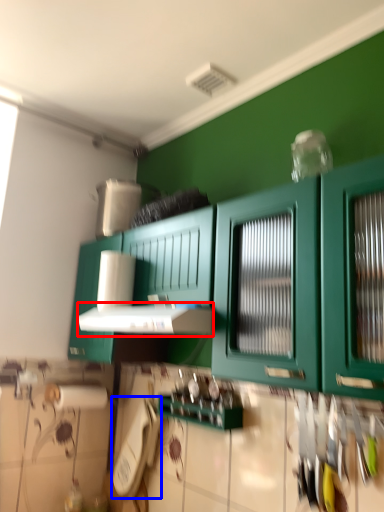
Question: Which point is closer to the camera, vent (highlighted by a red box) or appliance (highlighted by a blue box)?

Choices:
 (A) vent
 (B) appliance

Answer: (A)